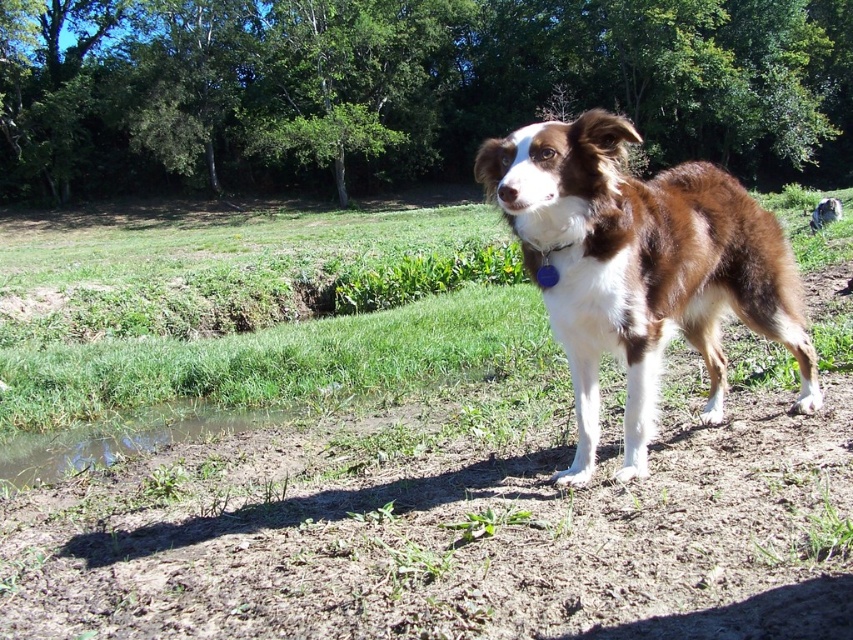
Who is taller, brown dirt field at center or green leafy tree at upper center?

green leafy tree at upper center is taller.

Who is positioned more to the right, brown dirt field at center or green leafy tree at upper center?

green leafy tree at upper center is more to the right.

Measure the distance between point (556, 616) and camera.

Point (556, 616) and camera are 1.69 meters apart.

You are a GUI agent. You are given a task and a screenshot of the screen. Output one action in this format:
    pyautogui.click(x=<x>, y=<y>)
    Task: Click on the brown dirt field at center
    
    Given the screenshot: What is the action you would take?
    pyautogui.click(x=421, y=483)

Which is more to the left, green leafy tree at upper center or brown/white fur dog at center?

green leafy tree at upper center is more to the left.

Does green leafy tree at upper center lie in front of brown/white fur dog at center?

No, green leafy tree at upper center is behind brown/white fur dog at center.

Is point (93, 3) in front of point (715, 353)?

No, (93, 3) is further to viewer.

The height and width of the screenshot is (640, 853). I want to click on green leafy tree at upper center, so click(x=405, y=88).

Can you confirm if brown dirt field at center is positioned below brown/white fur dog at center?

Yes.

Which is more to the right, brown dirt field at center or brown/white fur dog at center?

Positioned to the right is brown/white fur dog at center.

Measure the distance between point (813, 280) and camera.

The distance of point (813, 280) from camera is 7.83 meters.

Locate an element on the screen. brown dirt field at center is located at coordinates [x=421, y=483].